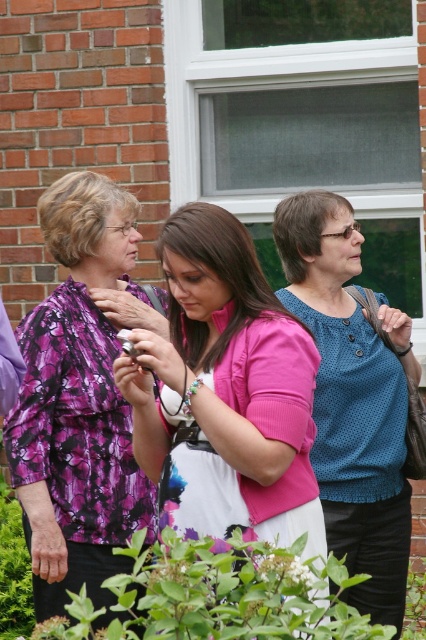
You are standing in front of the brick building with the window. You need to locate the pink matte shirt at center. According to the coordinates provided, where should you look relative to the window?

The pink matte shirt at center is located at coordinates point (224, 392), which is to the right and below the window.